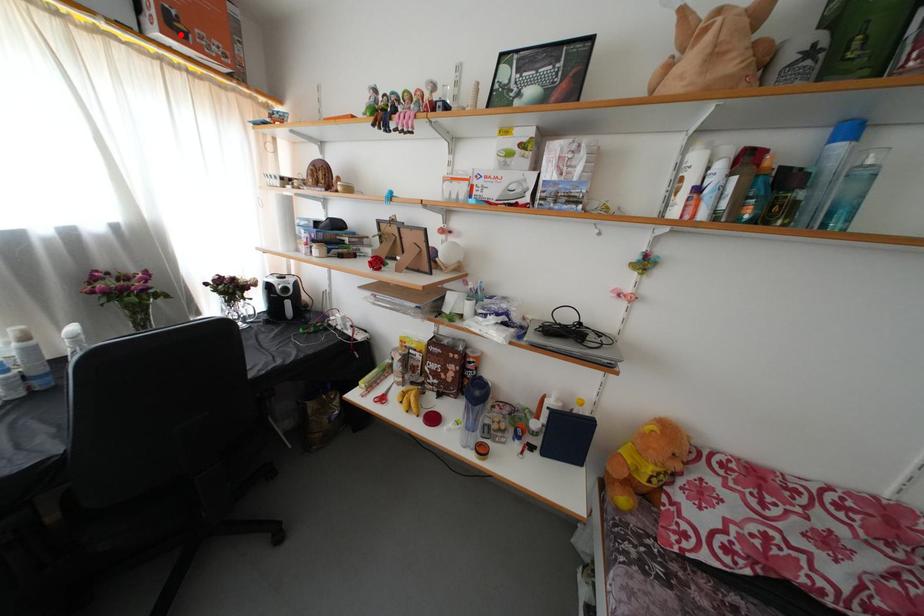
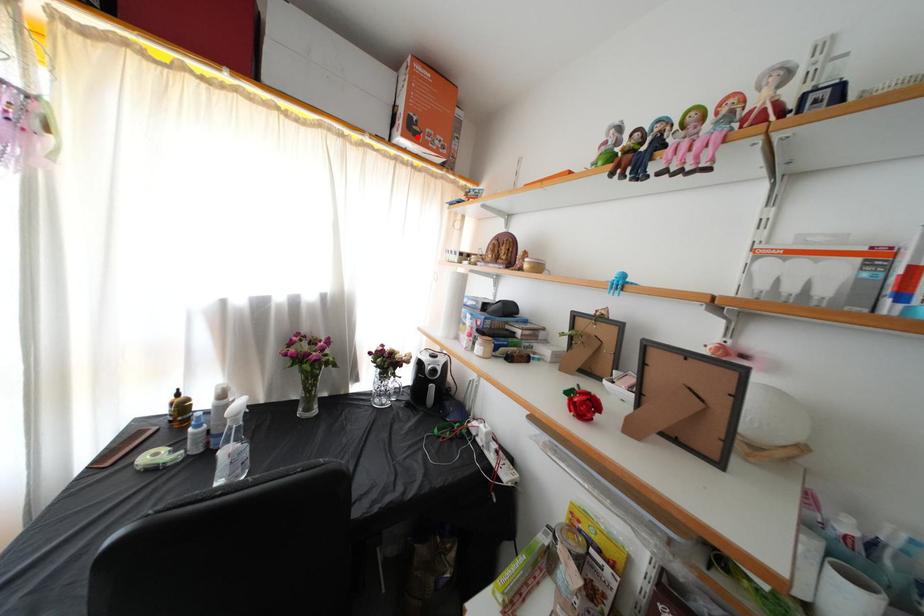
I am providing you with two images of the same scene from different viewpoints. A red point is marked on the first image and another point is marked on the second image. Is the marked point in image1 the same physical position as the marked point in image2?

Yes